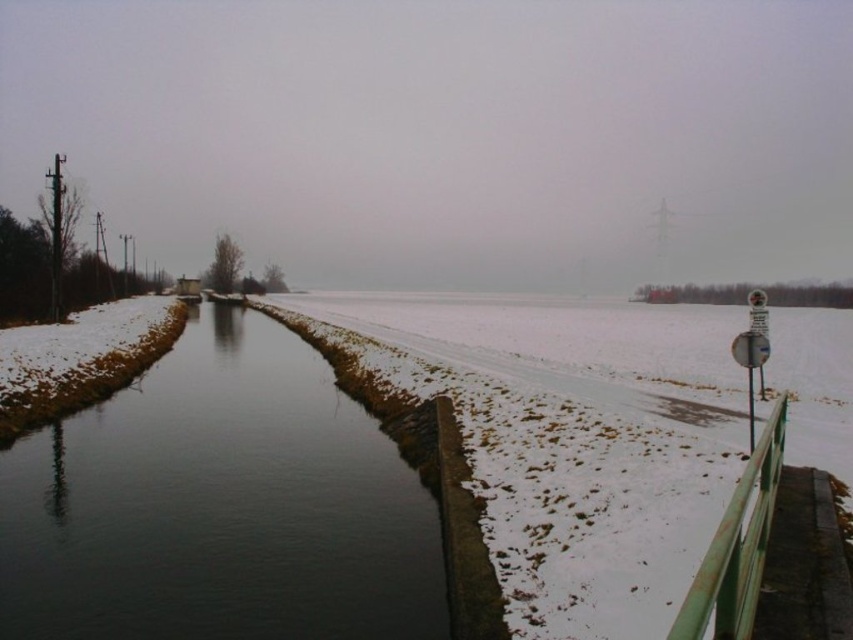
Between dark water at center and green painted metal rail at right, which one is positioned higher?

green painted metal rail at right

What do you see at coordinates (218, 506) in the screenshot? I see `dark water at center` at bounding box center [218, 506].

The height and width of the screenshot is (640, 853). I want to click on dark water at center, so click(218, 506).

You are a GUI agent. You are given a task and a screenshot of the screen. Output one action in this format:
    pyautogui.click(x=<x>, y=<y>)
    Task: Click on the dark water at center
    Image resolution: width=853 pixels, height=640 pixels.
    Given the screenshot: What is the action you would take?
    pyautogui.click(x=218, y=506)